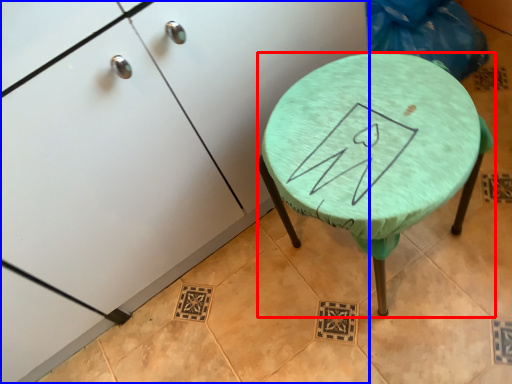
Question: Which point is closer to the camera, stool (highlighted by a red box) or furniture (highlighted by a blue box)?

Choices:
 (A) stool
 (B) furniture

Answer: (B)